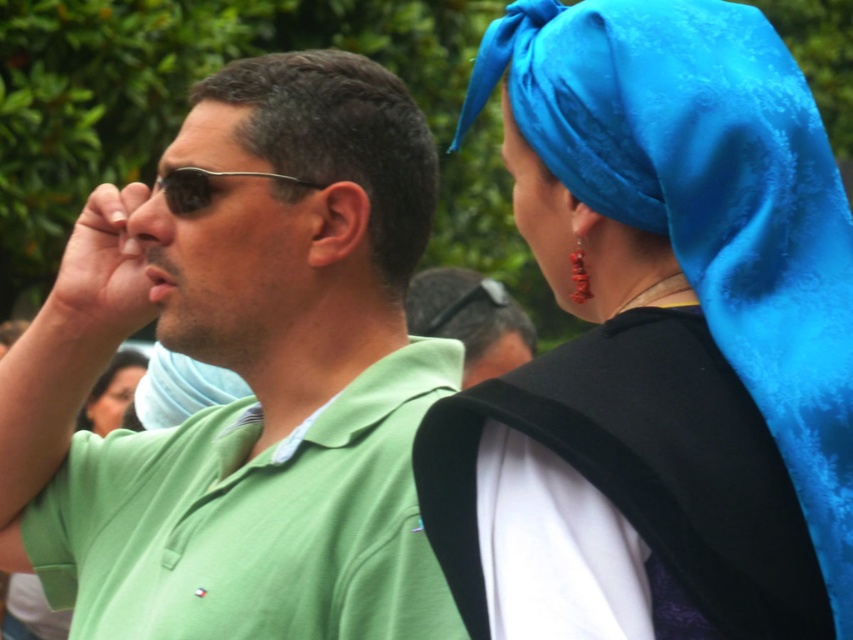
Which is in front, point (340, 440) or point (128, 349)?

Point (340, 440) is more forward.

Which is below, green matte shirt at center or smooth black hair at lower left?

Positioned lower is smooth black hair at lower left.

This screenshot has width=853, height=640. Find the location of `green matte shirt at center`. green matte shirt at center is located at coordinates (247, 381).

Measure the distance between point (486, 300) and camera.

Point (486, 300) is 7.58 meters away from camera.

Is green fabric shirt at center to the left of blue satin headscarf at upper right from the viewer's perspective?

Yes, green fabric shirt at center is to the left of blue satin headscarf at upper right.

Does point (434, 292) come behind point (503, 128)?

Yes, point (434, 292) is behind point (503, 128).

At what (x,y) coordinates should I click in order to perform the action: click on green fabric shirt at center. Please return your answer as a coordinate pair (x, y). Looking at the image, I should click on (469, 320).

Can you confirm if matte green shirt at center is taller than green fabric shirt at center?

Yes.

Measure the distance between point [223,104] and camera.

They are 4.56 meters apart.

You are a GUI agent. You are given a task and a screenshot of the screen. Output one action in this format:
    pyautogui.click(x=<x>, y=<y>)
    Task: Click on the matte green shirt at center
    
    Given the screenshot: What is the action you would take?
    pyautogui.click(x=223, y=243)